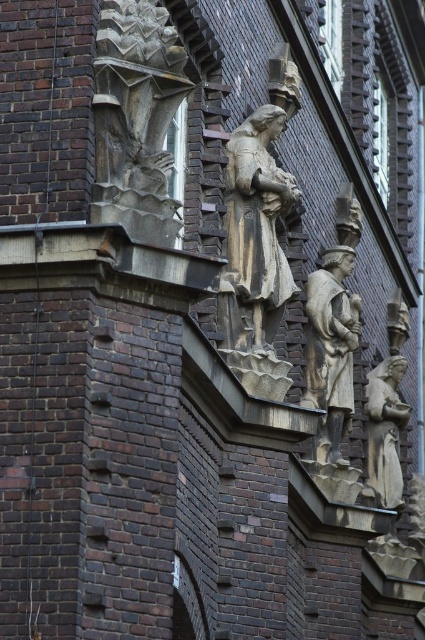
You are a tour guide leading a group near the brick building. You want to inform visitors about the distance between the stone statue at center and the polished bronze statue at center. What do you tell them?

The stone statue at center is 16.17 meters away from the polished bronze statue at center.